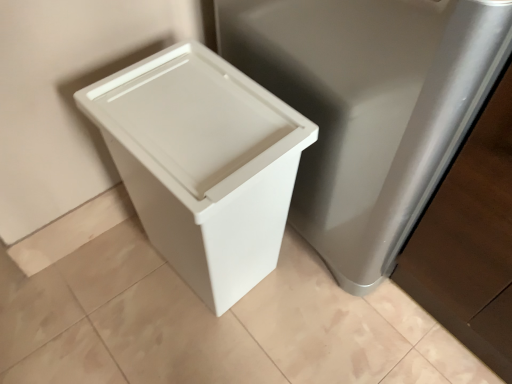
Find the location of a particular element. vacant space that's between white plastic waste container at left and beige wood baseboard at lower left is located at coordinates (120, 279).